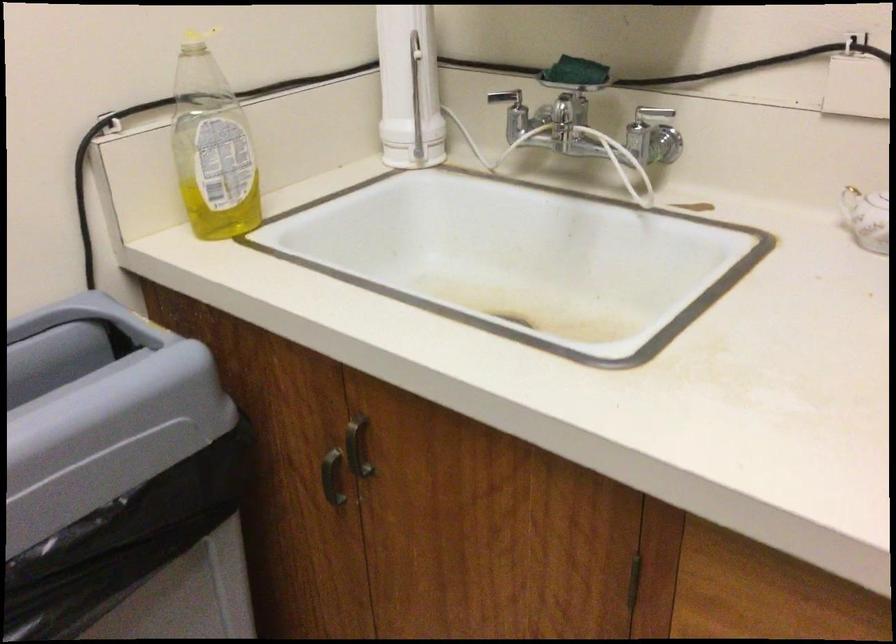
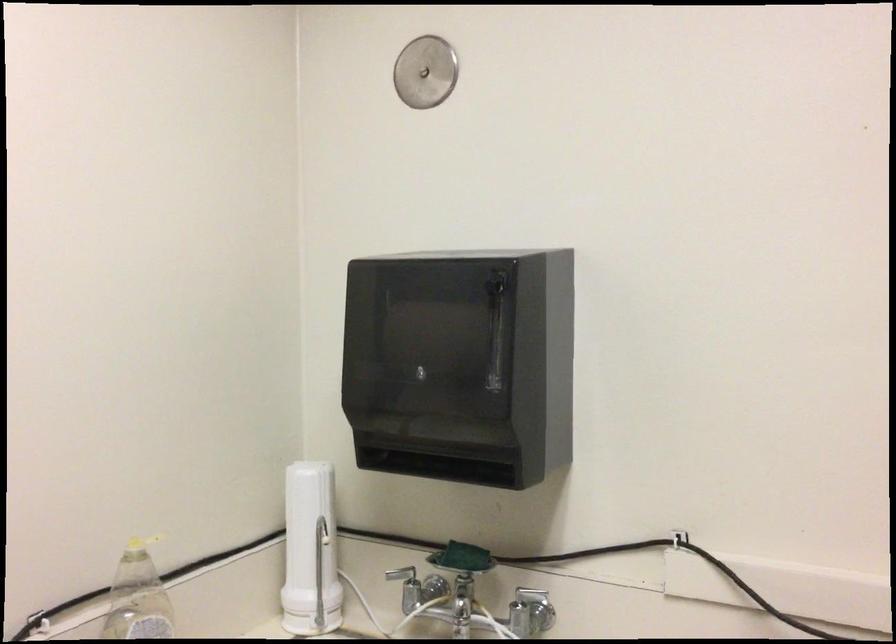
Where in the second image is the point corresponding to the point at 573,76 from the first image?

(462, 558)